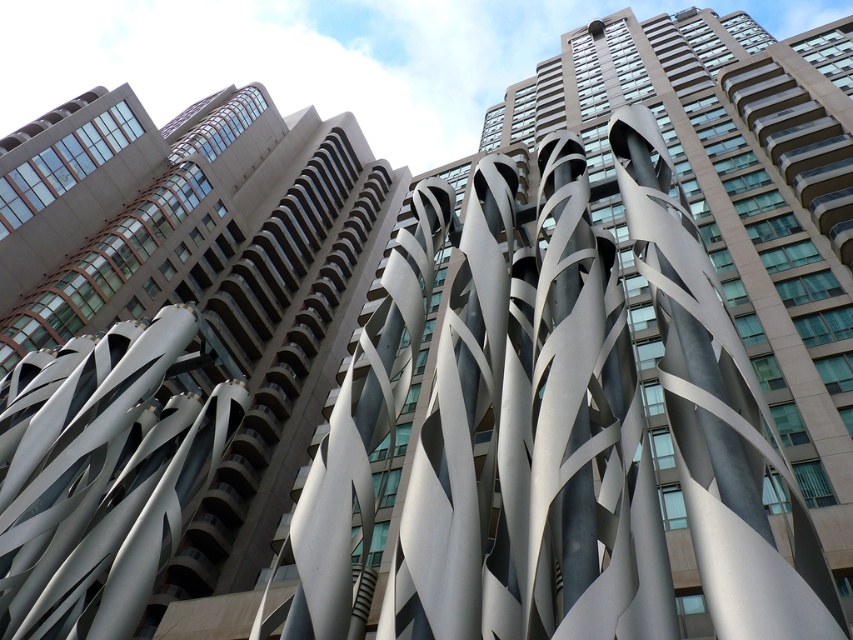
You are an architect analyzing the modern building with two central sculptures. Which sculpture, the metallic silver sculpture at center or the satin silver sculpture at center, is positioned higher up in the scene?

The metallic silver sculpture at center is positioned higher up in the scene as it is above the satin silver sculpture at center.

You are standing in front of the modern building with spiral elements. A drone is flying at point labeled as point (x=187, y=252). If you want to take a photo of the drone from your current position, will you be able to see it clearly? Please explain based on the distance.

The distance of point (x=187, y=252) from viewer is 64.24 meters. Since the drone is located at this point, it is 64.24 meters away from you. Whether you can see it clearly depends on the drone size and your vision capability, but the distance itself is 64.24 meters.

You are an architect analyzing the central area of the scene. You notice two sculptures labeled as metallic silver sculpture at center and satin silver sculpture at center. From your vantage point, which sculpture is positioned to the left?

The metallic silver sculpture at center is positioned to the left of the satin silver sculpture at center.